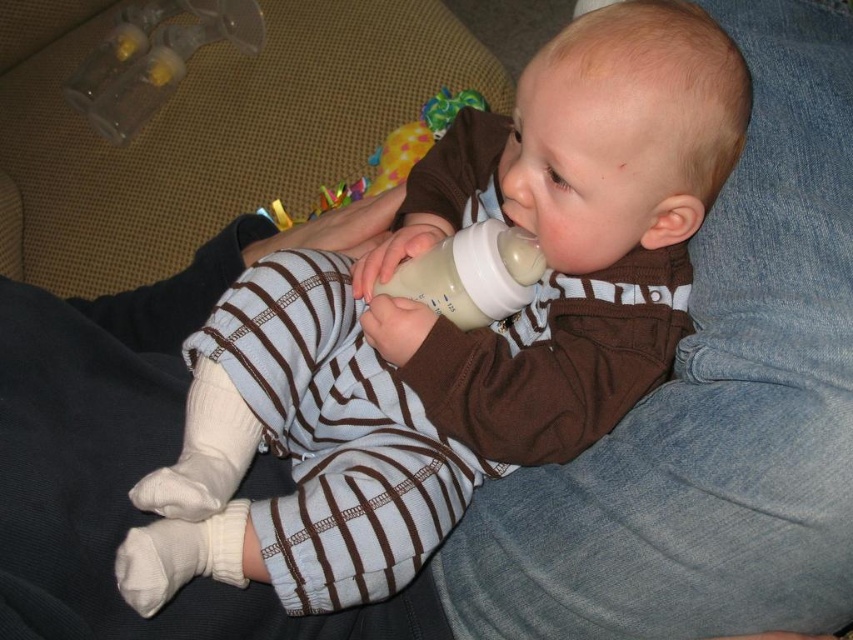
You are a photographer taking a picture of the baby. You need to ensure that both the blue striped onesie at center and the plastic colorful rattle at center are clearly visible in the photo. Which object should you focus on first to make sure it is in focus?

The blue striped onesie at center is larger in size than the plastic colorful rattle at center, so you should focus on the blue striped onesie at center first to ensure it is in focus.

Please describe the location of the plastic colorful rattle at center in the image using coordinates. The scene has a baby being fed from a bottle while sitting on someone lap. The baby is wearing a brown and white striped outfit with long sleeves and matching pants, along with white socks. The person holding the baby is wearing blue jeans and black clothing. In the background, there is a textured beige surface, possibly a couch or chair, and a colorful toy with yellow and green patterns is partially behind

The plastic colorful rattle at center is located at coordinates point (387, 156).

You are a caregiver trying to hand the baby a new bottle. The baby is currently holding the white plastic baby bottle at center. To replace it with the transparent plastic bottle at upper left, which bottle should you move first?

You should move the white plastic baby bottle at center first because it is in front of the transparent plastic bottle at upper left, so moving it will allow access to the transparent one.